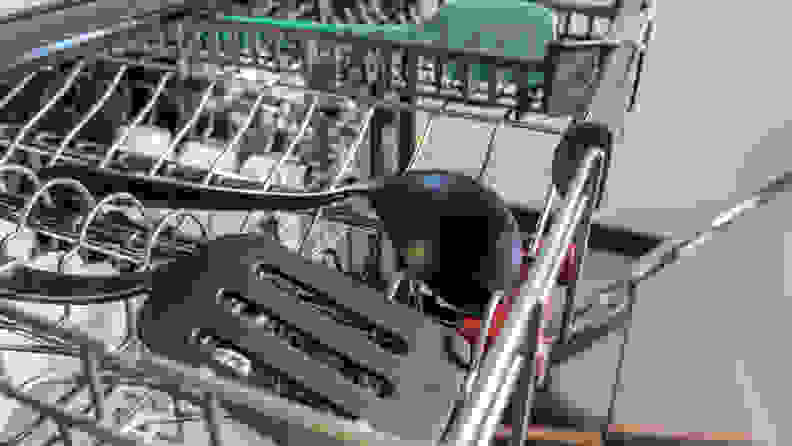
The image size is (792, 446). I want to click on black spatula, so click(x=417, y=386).